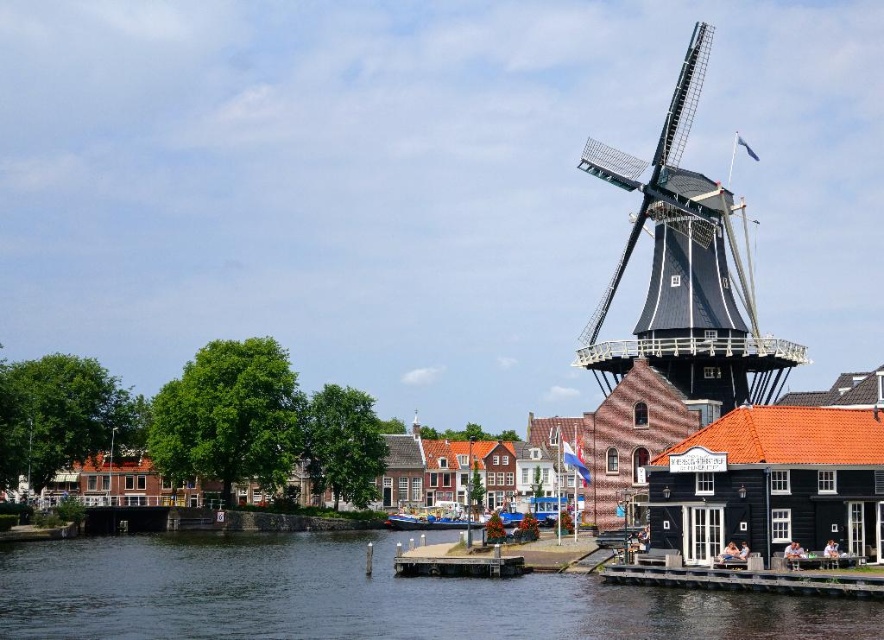
Is dark blue water at lower left to the right of dark brown wooden windmill at right from the viewer's perspective?

In fact, dark blue water at lower left is to the left of dark brown wooden windmill at right.

Is point (253, 600) more distant than point (761, 369)?

No.

Who is more forward, (591,637) or (673,177)?

Positioned in front is point (591,637).

Locate an element on the screen. The width and height of the screenshot is (884, 640). dark blue water at lower left is located at coordinates (363, 596).

Between dark blue water at lower left and blue wooden boat at center, which one appears on the right side from the viewer's perspective?

Positioned to the right is blue wooden boat at center.

From the picture: Is the position of dark blue water at lower left more distant than that of blue wooden boat at center?

No, dark blue water at lower left is closer to the viewer.

Where is `dark blue water at lower left`? The height and width of the screenshot is (640, 884). dark blue water at lower left is located at coordinates (363, 596).

Describe the element at coordinates (686, 268) in the screenshot. I see `dark brown wooden windmill at right` at that location.

In order to click on dark brown wooden windmill at right in this screenshot , I will do `click(686, 268)`.